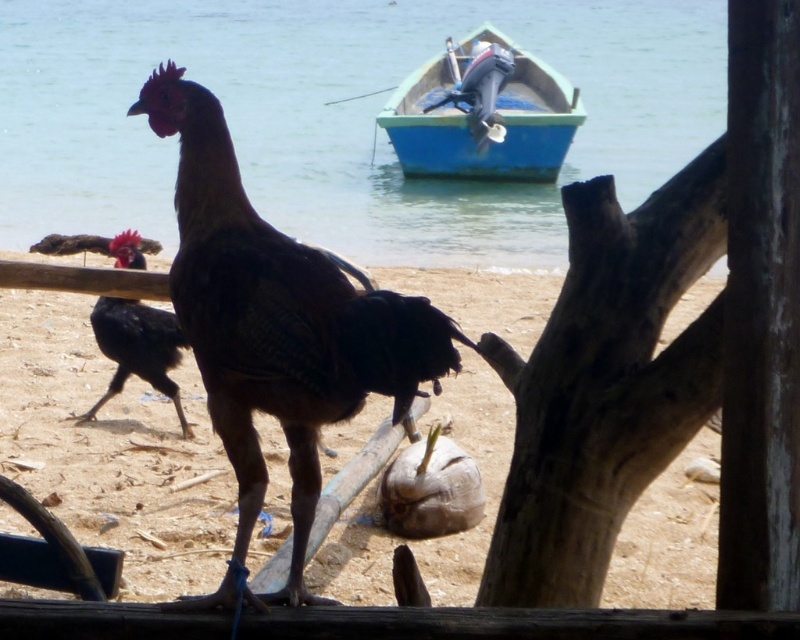
You are standing at the point marked by the coordinates point (338,116) in the coastal scene. What type of surface are you currently standing on?

The point (338,116) is on clear blue water at center, so you are standing on clear blue water.

You are standing at the point with coordinates point (538,125) and want to walk to the point (186,230). Which direction should you move relative to the scene?

You should move forward towards the point (186,230) because it is in front of point (538,125).

Consider the image. You are a birdwatcher standing at the edge of the beach. You see the shiny black rooster at center and the blue painted wood boat at upper center. How far apart are these two objects?

The shiny black rooster at center is 41.45 feet away from the blue painted wood boat at upper center.